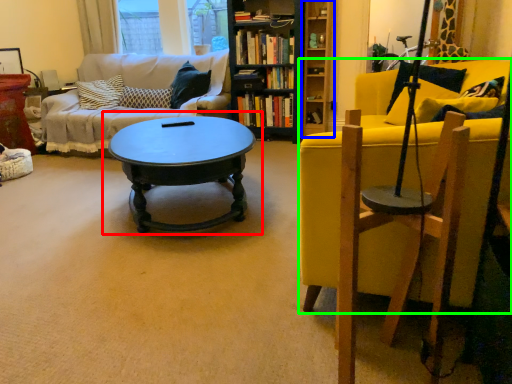
Question: Estimate the real-world distances between objects in this image. Which object is farther from coffee table (highlighted by a red box), shelf (highlighted by a blue box) or chair (highlighted by a green box)?

Choices:
 (A) shelf
 (B) chair

Answer: (A)